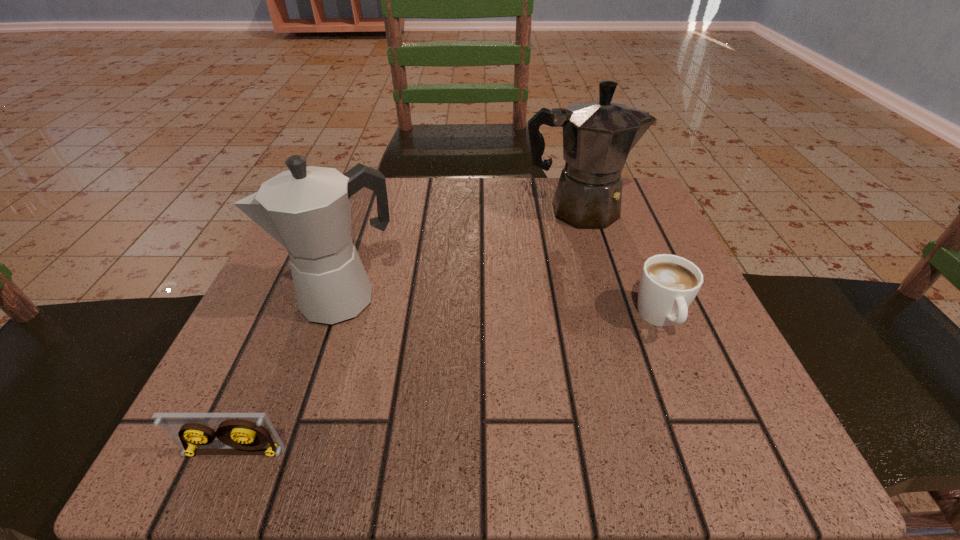
This screenshot has height=540, width=960. Find the location of `object that ranks as the closest to the cappuccino`. object that ranks as the closest to the cappuccino is located at coordinates (597, 135).

Locate which object is the second closest to the left coffeepot. Please provide its 2D coordinates. Your answer should be formatted as a tuple, i.e. [(x, y)], where the tuple contains the x and y coordinates of a point satisfying the conditions above.

[(597, 135)]